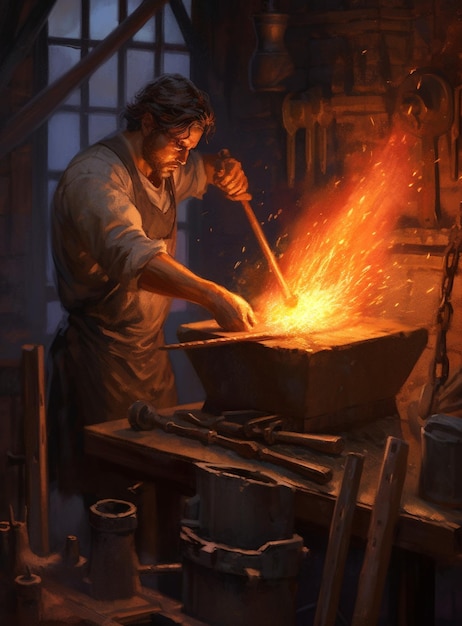
What are the coordinates of `table` in the screenshot? It's located at (139, 456).